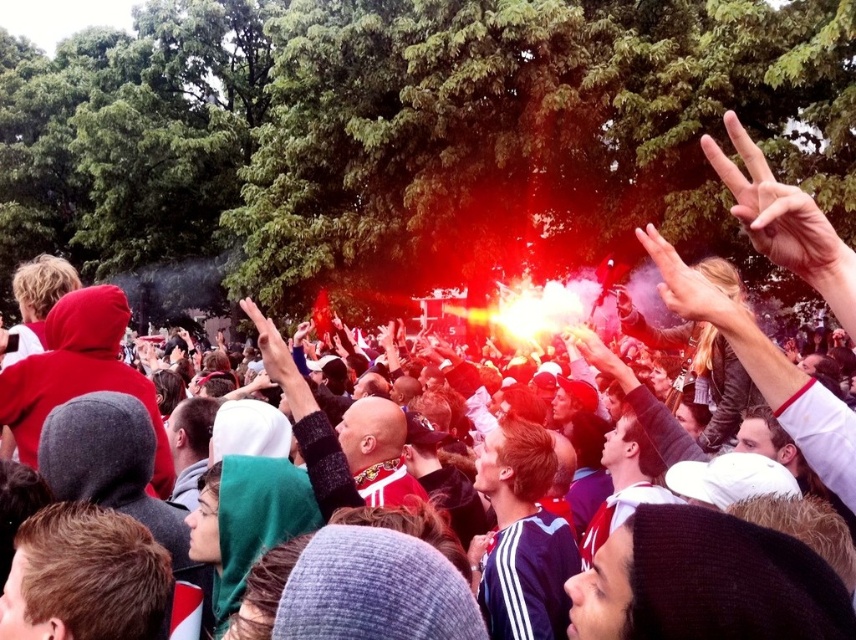
Question: Which object is closer to the camera taking this photo?

Choices:
 (A) smooth skin hand at upper right
 (B) skinny white hand at upper right

Answer: (B)

Question: Among these points, which one is farthest from the camera?

Choices:
 (A) (646, 236)
 (B) (801, 216)

Answer: (A)

Question: Is skinny white hand at upper right wider than smooth skin hand at upper right?

Choices:
 (A) no
 (B) yes

Answer: (B)

Question: Does skinny white hand at upper right have a larger size compared to smooth skin hand at upper right?

Choices:
 (A) yes
 (B) no

Answer: (A)

Question: Can you confirm if skinny white hand at upper right is positioned to the right of smooth skin hand at upper right?

Choices:
 (A) yes
 (B) no

Answer: (A)